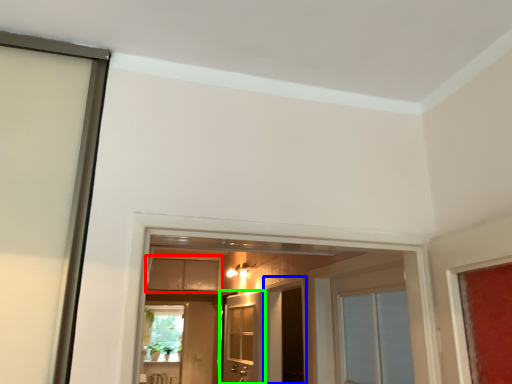
Question: Based on their relative distances, which object is nearer to cabinetry (highlighted by a red box)? Choose from screen door (highlighted by a blue box) and door (highlighted by a green box).

Choices:
 (A) screen door
 (B) door

Answer: (B)